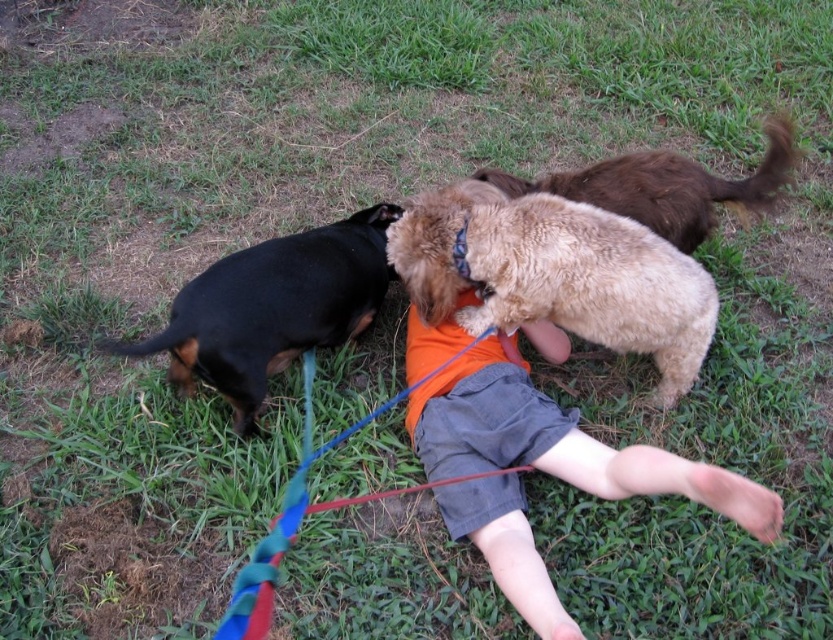
Consider the image. Is black smooth coat dog at left taller than brown fluffy dog at upper right?

Indeed, black smooth coat dog at left has a greater height compared to brown fluffy dog at upper right.

Which of these two, black smooth coat dog at left or brown fluffy dog at upper right, stands taller?

black smooth coat dog at left

You are a GUI agent. You are given a task and a screenshot of the screen. Output one action in this format:
    pyautogui.click(x=<x>, y=<y>)
    Task: Click on the black smooth coat dog at left
    Image resolution: width=833 pixels, height=640 pixels.
    Given the screenshot: What is the action you would take?
    pyautogui.click(x=272, y=308)

Is point (502, 413) in front of point (569, 228)?

No, (502, 413) is behind (569, 228).

Can you confirm if orange t-shirt at center is positioned to the left of fuzzy beige dog at center?

Correct, you'll find orange t-shirt at center to the left of fuzzy beige dog at center.

In the scene shown: Measure the distance between point (x=479, y=424) and camera.

A distance of 2.15 meters exists between point (x=479, y=424) and camera.

Where is `orange t-shirt at center`? The image size is (833, 640). orange t-shirt at center is located at coordinates (557, 442).

Is black smooth coat dog at left bigger than multicolored fabric leash at center?

Incorrect, black smooth coat dog at left is not larger than multicolored fabric leash at center.

At what (x,y) coordinates should I click in order to perform the action: click on black smooth coat dog at left. Please return your answer as a coordinate pair (x, y). Looking at the image, I should click on (272, 308).